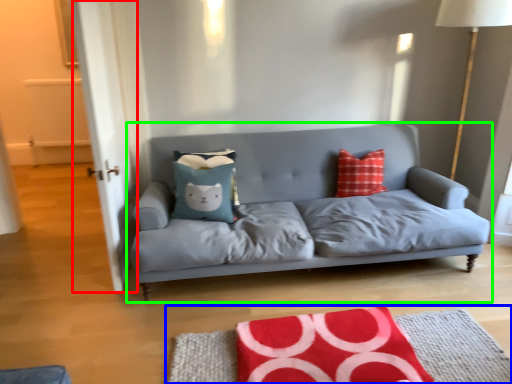
Question: Which object is positioned closest to glass door (highlighted by a red box)? Select from mat (highlighted by a blue box) and studio couch (highlighted by a green box).

Choices:
 (A) mat
 (B) studio couch

Answer: (B)